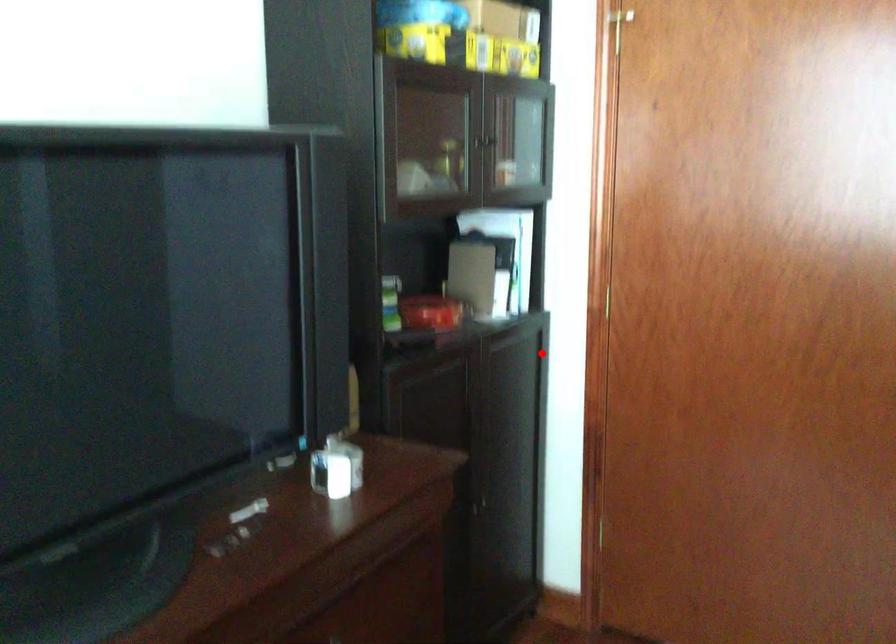
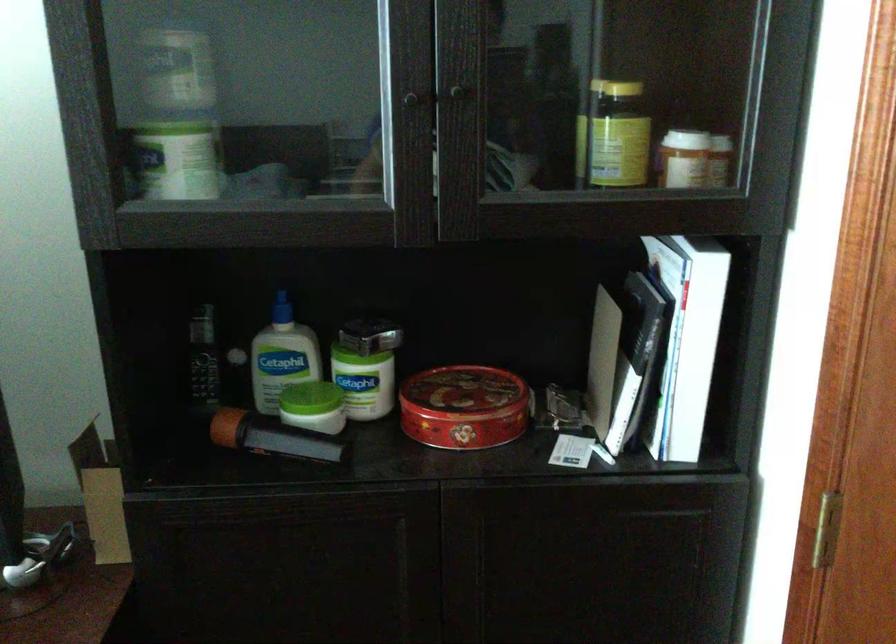
Locate, in the second image, the point that corresponds to the highlighted location in the first image.

(707, 554)